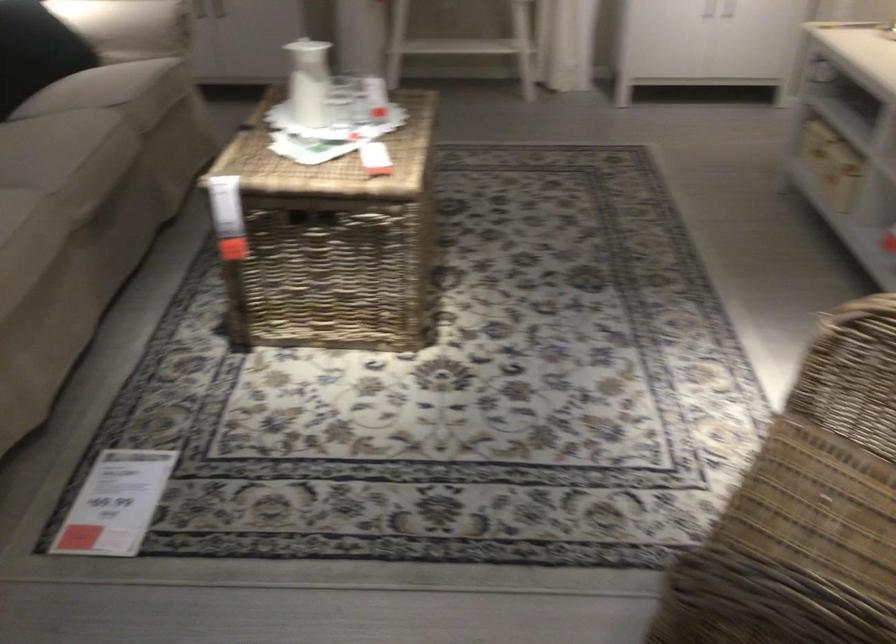
Find where to sit the sofa sitting surface. Please return your answer as a coordinate pair (x, y).

(109, 140)